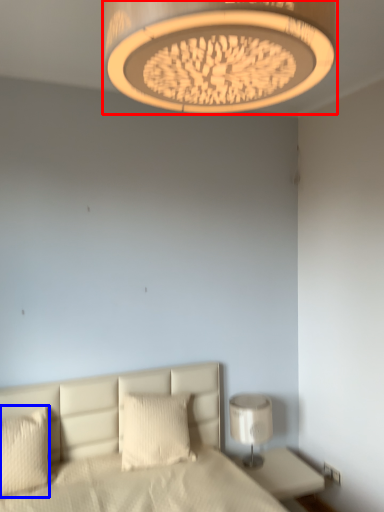
Question: Which object is further to the camera taking this photo, lamp (highlighted by a red box) or pillow (highlighted by a blue box)?

Choices:
 (A) lamp
 (B) pillow

Answer: (B)